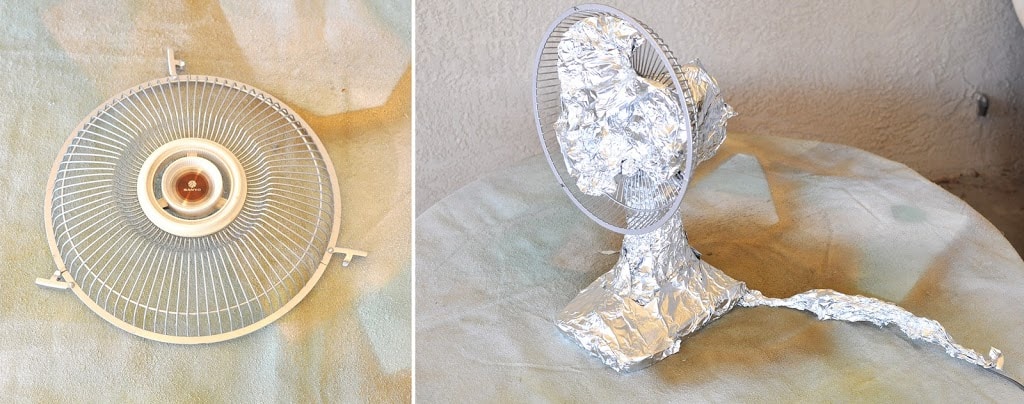
You are a GUI agent. You are given a task and a screenshot of the screen. Output one action in this format:
    pyautogui.click(x=<x>, y=<y>)
    Task: Click on the white textured wall
    The width and height of the screenshot is (1024, 404).
    Given the screenshot: What is the action you would take?
    pyautogui.click(x=777, y=61)